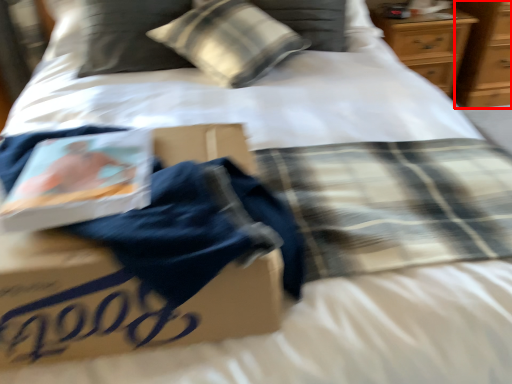
Question: In this image, where is dresser (annotated by the red box) located relative to pillow?

Choices:
 (A) right
 (B) left

Answer: (A)